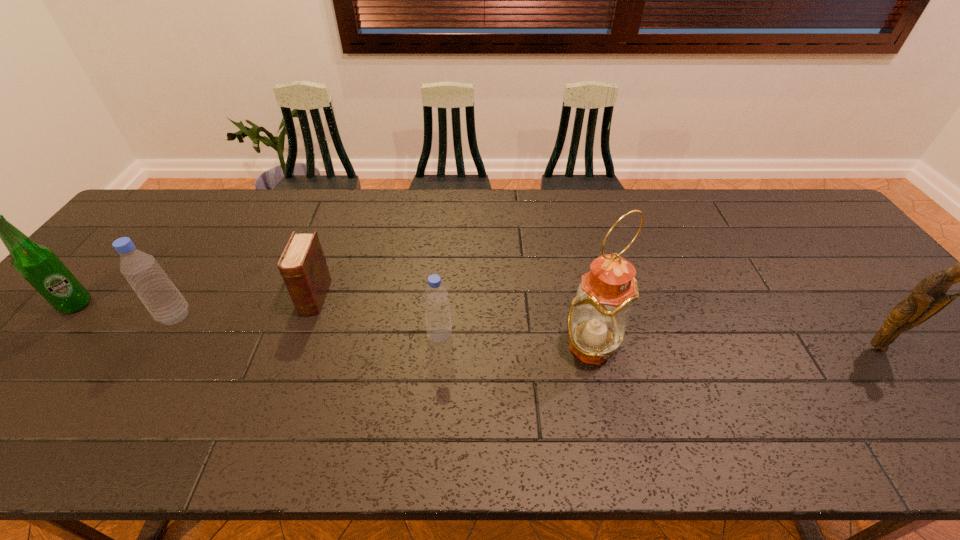
Please point a spot to add another bottle on the right. Please provide its 2D coordinates. Your answer should be formatted as a tuple, i.e. [(x, y)], where the tuple contains the x and y coordinates of a point satisfying the conditions above.

[(727, 357)]